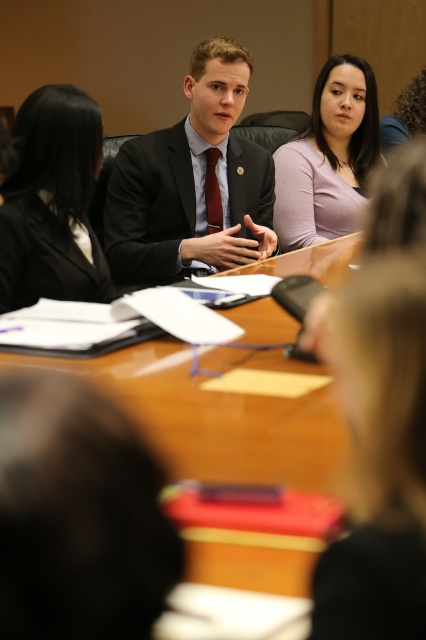
Who is more forward, (385, 269) or (216, 72)?

Point (385, 269)

Is point (416, 392) positioned in front of point (230, 58)?

That is True.

At what (x,y) coordinates should I click in order to perform the action: click on blonde hair at lower right. Please return your answer as a coordinate pair (x, y). The height and width of the screenshot is (640, 426). Looking at the image, I should click on (379, 454).

Can you confirm if blonde hair at lower right is wider than black suit at left?

Incorrect, blonde hair at lower right's width does not surpass black suit at left's.

Who is higher up, blonde hair at lower right or black suit at left?

black suit at left is above.

At what (x,y) coordinates should I click in order to perform the action: click on blonde hair at lower right. Please return your answer as a coordinate pair (x, y). This screenshot has width=426, height=640. Looking at the image, I should click on (379, 454).

Who is higher up, blonde hair at lower right or matte purple shirt at center?

matte purple shirt at center

Is blonde hair at lower right above matte purple shirt at center?

No.

Where is `blonde hair at lower right`? blonde hair at lower right is located at coordinates (379, 454).